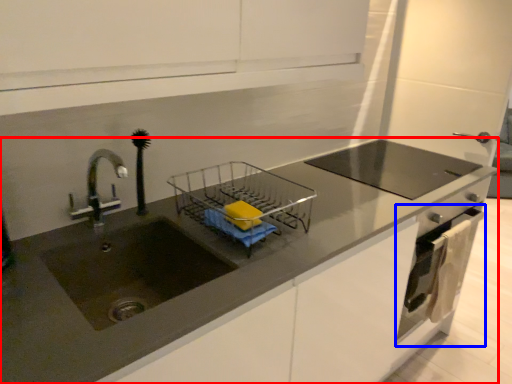
Question: Which object appears farthest to the camera in this image, countertop (highlighted by a red box) or oven (highlighted by a blue box)?

Choices:
 (A) countertop
 (B) oven

Answer: (B)